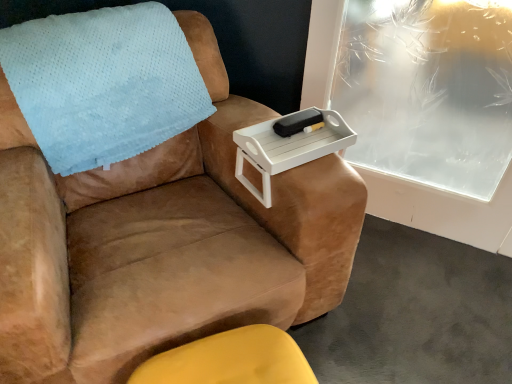
Identify the location of free space above matte yellow ottoman at lower center (from a real-world perspective). (228, 362).